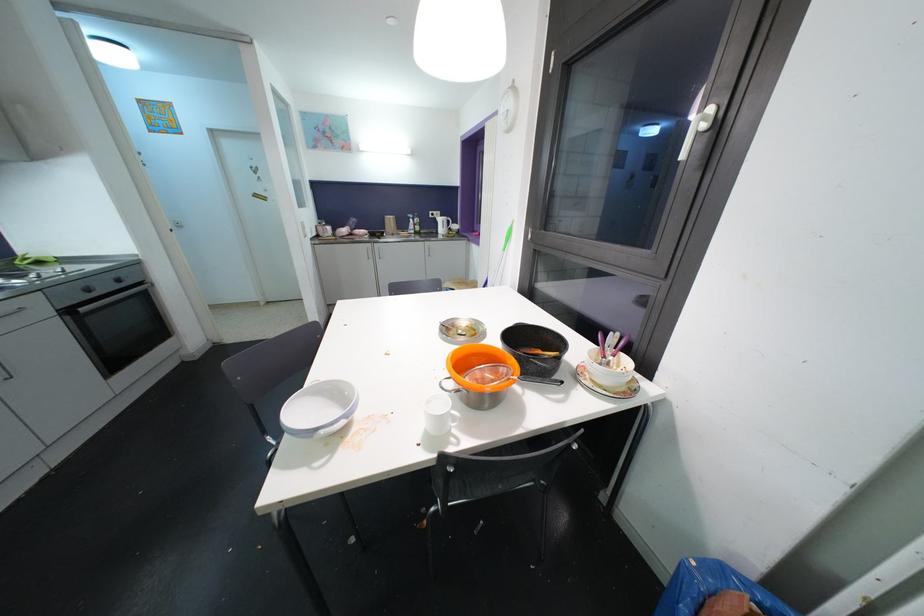
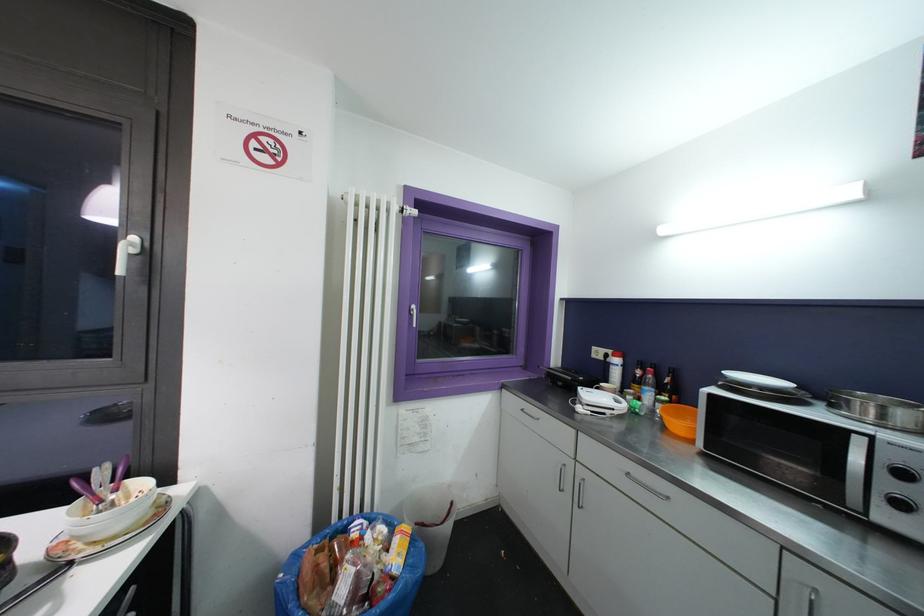
Locate, in the second image, the point that corresponds to point (625, 357) in the first image.

(131, 484)